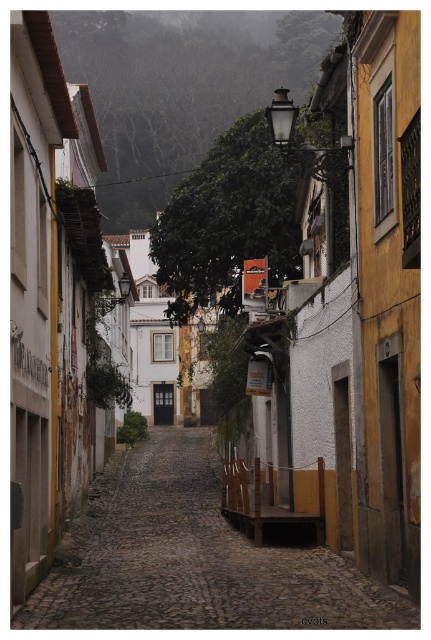
Question: Is yellow textured wall at right to the left of green leafy hillside at upper center from the viewer's perspective?

Choices:
 (A) no
 (B) yes

Answer: (A)

Question: Which object is farther from the camera taking this photo?

Choices:
 (A) smooth stone path at center
 (B) green leafy hillside at upper center
 (C) yellow textured wall at right

Answer: (B)

Question: Is smooth stone path at center to the left of yellow textured wall at right from the viewer's perspective?

Choices:
 (A) yes
 (B) no

Answer: (A)

Question: Which of the following is the closest to the observer?

Choices:
 (A) yellow textured wall at right
 (B) green leafy hillside at upper center
 (C) smooth stone path at center

Answer: (C)

Question: Which object is closer to the camera taking this photo?

Choices:
 (A) green leafy hillside at upper center
 (B) yellow textured wall at right

Answer: (B)

Question: Does smooth stone path at center have a greater width compared to yellow textured wall at right?

Choices:
 (A) no
 (B) yes

Answer: (B)